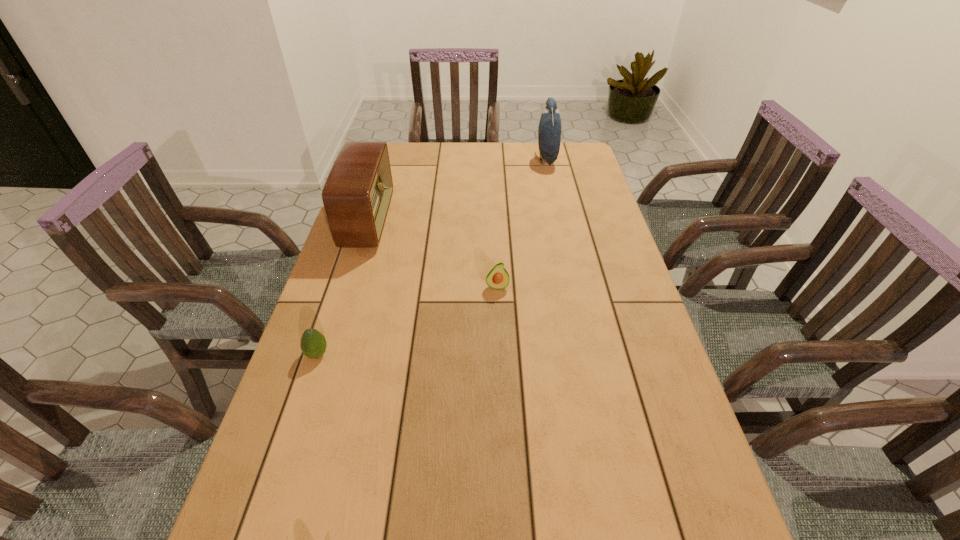
Locate an element on the screen. Image resolution: width=960 pixels, height=540 pixels. free point at the right edge is located at coordinates (566, 199).

I want to click on free area in between the farthest object and the radio receiver, so click(457, 191).

This screenshot has height=540, width=960. Find the location of `vacant area that lies between the bird and the radio receiver`. vacant area that lies between the bird and the radio receiver is located at coordinates (457, 191).

Identify the location of vacant area that lies between the nearer avocado and the farthest object. The height and width of the screenshot is (540, 960). (432, 257).

Identify the location of empty space between the bird and the second nearest object. The height and width of the screenshot is (540, 960). (521, 223).

Locate an element on the screen. This screenshot has width=960, height=540. vacant space that is in between the radio receiver and the rightmost object is located at coordinates (457, 191).

Point out which object is positioned as the second nearest to the third object from left to right. Please provide its 2D coordinates. Your answer should be formatted as a tuple, i.e. [(x, y)], where the tuple contains the x and y coordinates of a point satisfying the conditions above.

[(313, 344)]

Choose which object is the second nearest neighbor to the farthest object. Please provide its 2D coordinates. Your answer should be formatted as a tuple, i.e. [(x, y)], where the tuple contains the x and y coordinates of a point satisfying the conditions above.

[(498, 278)]

Find the location of a particular element. This screenshot has width=960, height=540. the second closest avocado relative to the farthest object is located at coordinates (313, 344).

Identify the location of vacant space that satisfies the following two spatial constraints: 1. at the tip of the bird's beak; 2. on the front side of the nearest object. (589, 354).